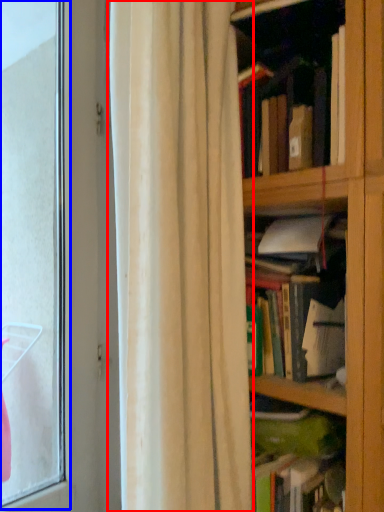
Question: Which point is closer to the camera, curtain (highlighted by a red box) or bay window (highlighted by a blue box)?

Choices:
 (A) curtain
 (B) bay window

Answer: (A)